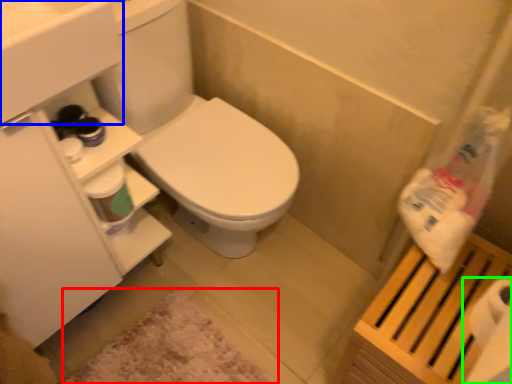
Question: Estimate the real-world distances between objects in this image. Which object is farther from bath mat (highlighted by a red box), sink (highlighted by a blue box) or toilet paper (highlighted by a green box)?

Choices:
 (A) sink
 (B) toilet paper

Answer: (A)